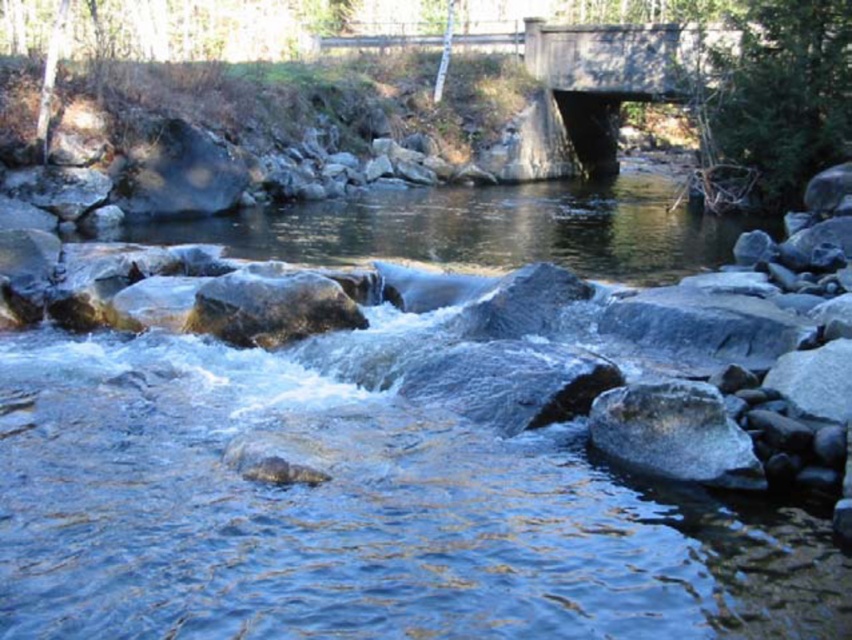
Is smooth gray rocks at center closer to the viewer compared to smooth gray rock at center?

No, it is behind smooth gray rock at center.

Which is above, smooth gray rocks at center or smooth gray rock at center?

smooth gray rocks at center is higher up.

Is point (311, 236) more distant than point (694, 397)?

Yes, it is.

At what (x,y) coordinates should I click in order to perform the action: click on smooth gray rocks at center. Please return your answer as a coordinate pair (x, y). This screenshot has width=852, height=640. Looking at the image, I should click on (485, 228).